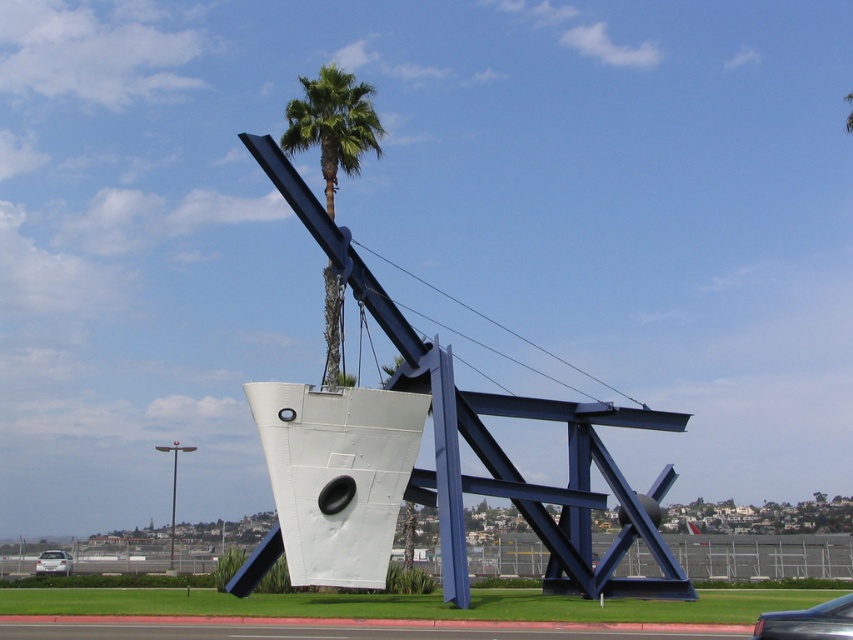
Question: Does green leafy palm tree at upper center appear under white glossy car at lower left?

Choices:
 (A) no
 (B) yes

Answer: (A)

Question: Estimate the real-world distances between objects in this image. Which object is closer to the white glossy car at lower left?

Choices:
 (A) green leafy palm tree at upper center
 (B) metallic blue car at center

Answer: (A)

Question: Does green leafy palm tree at upper center lie behind metallic blue car at center?

Choices:
 (A) yes
 (B) no

Answer: (A)

Question: Which object is closer to the camera taking this photo?

Choices:
 (A) white glossy car at lower left
 (B) metallic blue car at center

Answer: (B)

Question: Considering the real-world distances, which object is closest to the metallic blue car at center?

Choices:
 (A) white glossy car at lower left
 (B) green leafy palm tree at upper center

Answer: (B)

Question: Observing the image, what is the correct spatial positioning of metallic blue car at center in reference to white glossy car at lower left?

Choices:
 (A) right
 (B) left

Answer: (A)